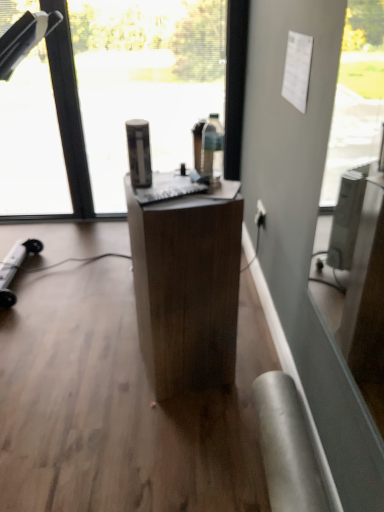
Question: Considering the positions of wooden desk at center and white plastic power outlet at lower right in the image, is wooden desk at center taller or shorter than white plastic power outlet at lower right?

Choices:
 (A) tall
 (B) short

Answer: (A)

Question: In terms of width, does wooden desk at center look wider or thinner when compared to white plastic power outlet at lower right?

Choices:
 (A) thin
 (B) wide

Answer: (B)

Question: Estimate the real-world distances between objects in this image. Which object is farther from the white plastic power outlet at lower right?

Choices:
 (A) transparent glass window at center
 (B) wooden desk at center

Answer: (A)

Question: Considering the real-world distances, which object is farthest from the transparent glass window at center?

Choices:
 (A) wooden desk at center
 (B) white plastic power outlet at lower right

Answer: (A)